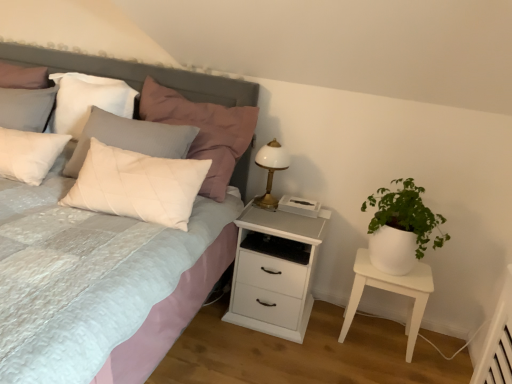
Question: Is white quilted pillow at upper left, the 1th pillow positioned from the right, positioned in front of white matte table at right?

Choices:
 (A) yes
 (B) no

Answer: (A)

Question: Is white quilted pillow at upper left, which ranks as the 2th pillow in left-to-right order, not near white matte table at right?

Choices:
 (A) no
 (B) yes

Answer: (B)

Question: Is white quilted pillow at upper left, the 1th pillow positioned from the right, shorter than white matte table at right?

Choices:
 (A) yes
 (B) no

Answer: (B)

Question: Considering the relative positions of white quilted pillow at upper left, the 1th pillow positioned from the right, and white matte table at right in the image provided, is white quilted pillow at upper left, the 1th pillow positioned from the right, to the left of white matte table at right from the viewer's perspective?

Choices:
 (A) no
 (B) yes

Answer: (B)

Question: Is white quilted pillow at upper left, which ranks as the 2th pillow in left-to-right order, located outside white matte table at right?

Choices:
 (A) yes
 (B) no

Answer: (A)

Question: Looking at their shapes, would you say matte gray headboard at upper left is wider or thinner than white quilted pillow at upper left, the 1th pillow positioned from the right?

Choices:
 (A) thin
 (B) wide

Answer: (A)

Question: From a real-world perspective, is matte gray headboard at upper left physically located above or below white quilted pillow at upper left, the 1th pillow positioned from the right?

Choices:
 (A) below
 (B) above

Answer: (A)

Question: From the image's perspective, is matte gray headboard at upper left above or below white quilted pillow at upper left, which ranks as the 2th pillow in left-to-right order?

Choices:
 (A) above
 (B) below

Answer: (B)

Question: Would you say matte gray headboard at upper left is to the left or to the right of white quilted pillow at upper left, the 1th pillow positioned from the right, in the picture?

Choices:
 (A) right
 (B) left

Answer: (B)

Question: Does point (264, 331) appear closer or farther from the camera than point (380, 215)?

Choices:
 (A) closer
 (B) farther

Answer: (B)

Question: Relative to green leafy plant in white pot at right, is white matte nightstand at center in front or behind?

Choices:
 (A) behind
 (B) front

Answer: (A)

Question: Visually, is white matte nightstand at center positioned to the left or to the right of green leafy plant in white pot at right?

Choices:
 (A) right
 (B) left

Answer: (B)

Question: From a real-world perspective, is white matte nightstand at center physically located above or below green leafy plant in white pot at right?

Choices:
 (A) above
 (B) below

Answer: (B)

Question: Considering the positions of white quilted pillow at upper left, the first pillow viewed from the left, and white quilted pillow at upper left, which ranks as the 2th pillow in left-to-right order, in the image, is white quilted pillow at upper left, the first pillow viewed from the left, wider or thinner than white quilted pillow at upper left, which ranks as the 2th pillow in left-to-right order,?

Choices:
 (A) wide
 (B) thin

Answer: (B)

Question: From a real-world perspective, is white quilted pillow at upper left, arranged as the 2th pillow when viewed from the right, positioned above or below white quilted pillow at upper left, which ranks as the 2th pillow in left-to-right order?

Choices:
 (A) below
 (B) above

Answer: (A)